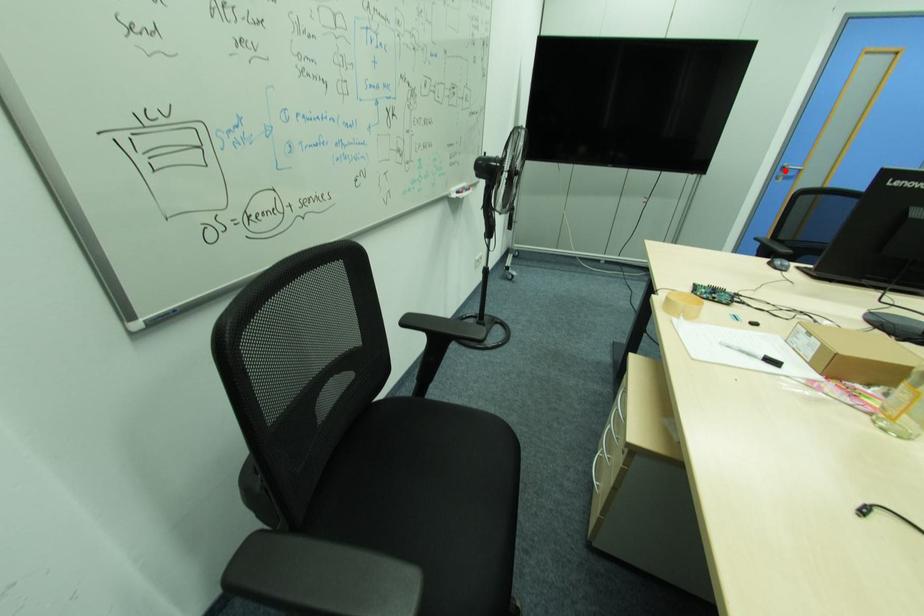
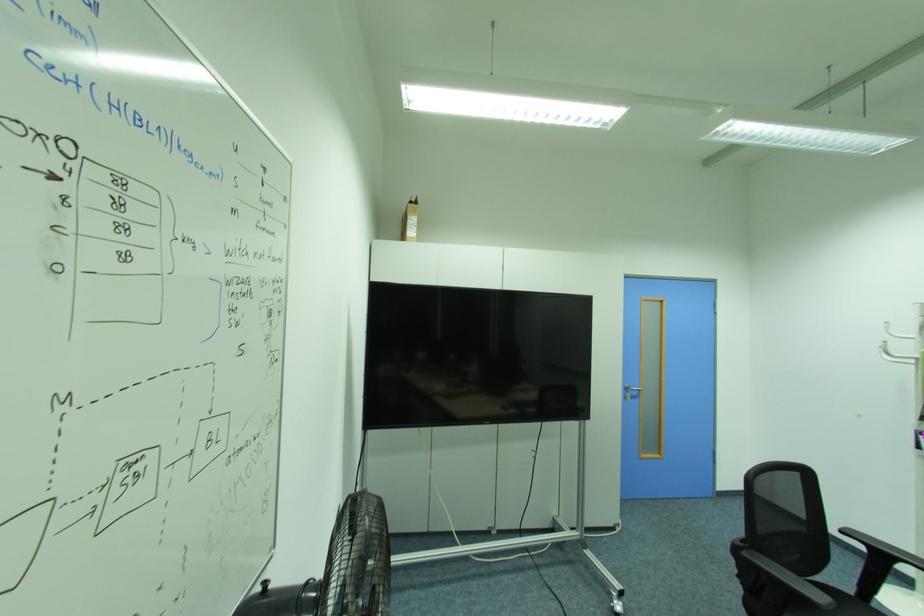
Question: I am providing you with two images of the same scene from different viewpoints. Image1 has a red point marked. In image2, the corresponding 3D location appears at what relative position? Reply with the corresponding letter.

Choices:
 (A) Closer
 (B) Farther

Answer: (B)